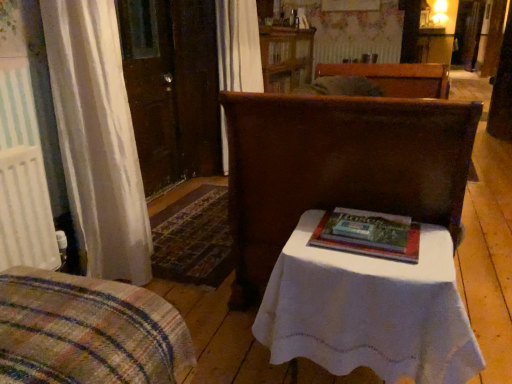
Where is `space that is in front of hardcover book at center`? This screenshot has width=512, height=384. space that is in front of hardcover book at center is located at coordinates (379, 260).